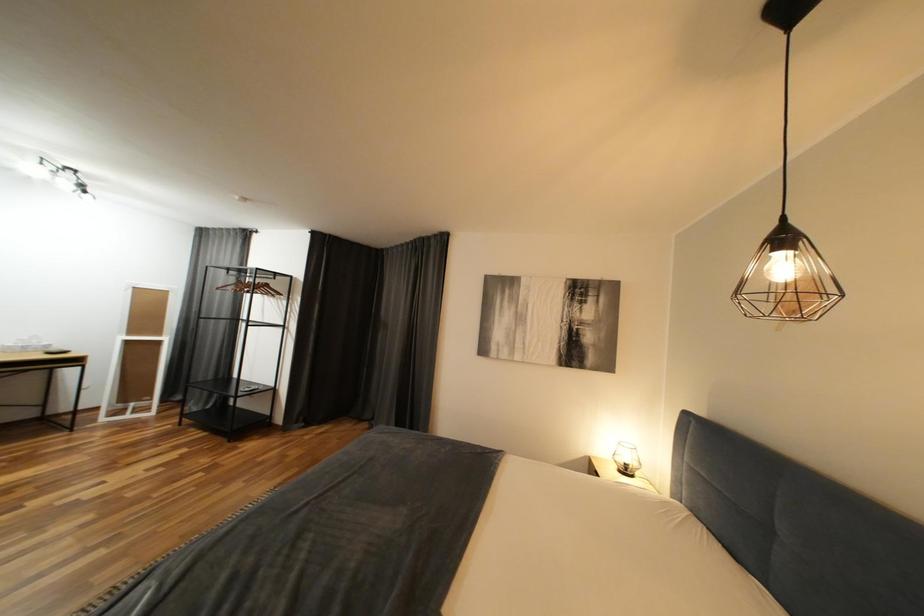
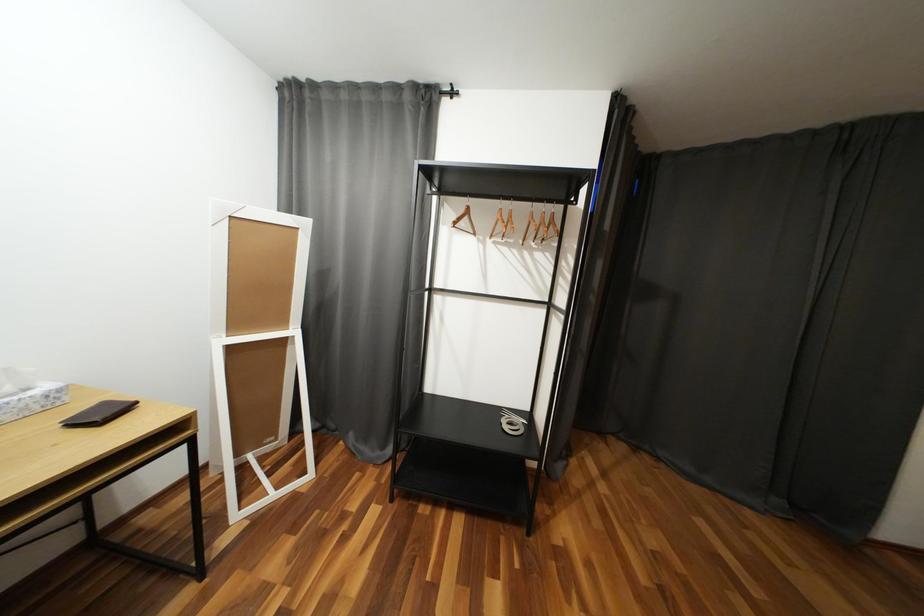
Which direction would the cameraman need to move to produce the second image?

The movement direction of the cameraman is left, forward.